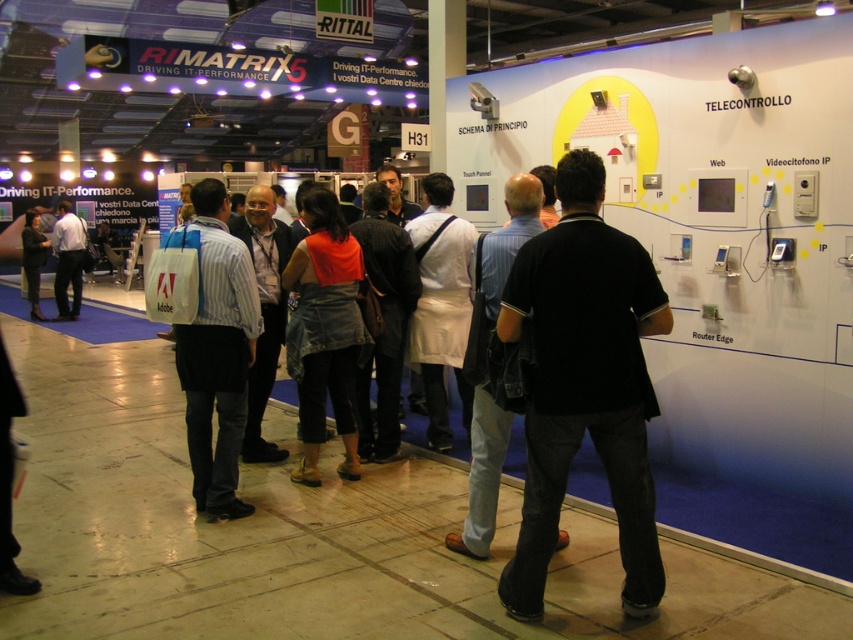
You are a photographer at the exhibition hall. You need to capture a photo of the striped cotton shirt at center and denim skirt at center. Which one should you zoom in on to ensure both fit in the frame without cropping?

The striped cotton shirt at center has a lesser width compared to denim skirt at center, so you should zoom in on the denim skirt at center to ensure both fit in the frame without cropping.

You are a photographer at the exhibition hall and want to capture a photo of the striped cotton shirt at center and the white fabric apron at center. Based on their positions, which one is positioned lower in the image?

The striped cotton shirt at center is located below the white fabric apron at center, so the striped cotton shirt at center is positioned lower in the image.

You are a visitor at the exhibition hall and want to approach the Telecontrollo booth. You see the white fabric apron at center and the dark blue jeans at left. Which object is closer to you?

The white fabric apron at center is closer to you because it is in front of the dark blue jeans at left.